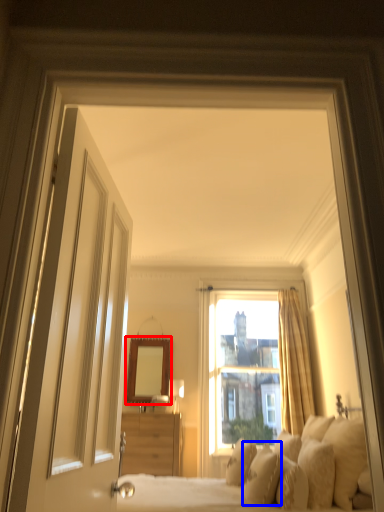
Question: Among these objects, which one is nearest to the camera, mirror (highlighted by a red box) or pillow (highlighted by a blue box)?

Choices:
 (A) mirror
 (B) pillow

Answer: (B)